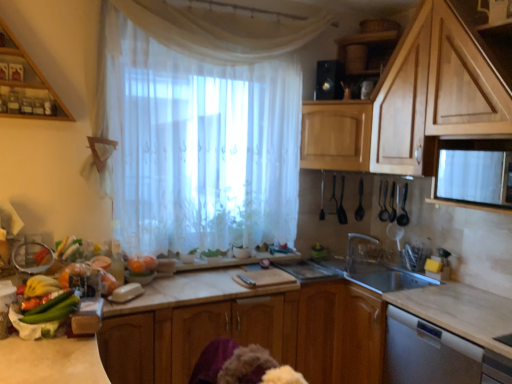
Locate an element on the screen. free area behind silver metallic faucet at lower center is located at coordinates (355, 269).